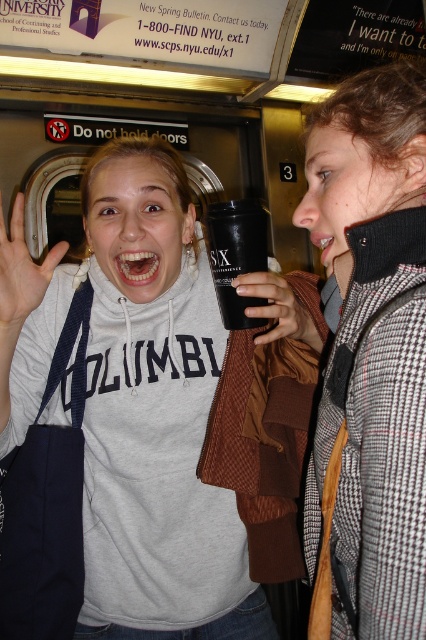
You are a photographer trying to capture a candid shot of the two people in the subway car. You want to ensure that both the gray sweatshirt at center and the light skin tone hand at center are in focus. Given that your camera has a depth of field that can sharply focus objects within a 10 inch range, will both subjects be in focus?

The gray sweatshirt at center is 11.63 inches away from the light skin tone hand at center. Since the distance between them exceeds the camera sensor depth of field range of 10 inches, both subjects cannot be in focus simultaneously.

Based on the scene description, which object is taller between the houndstooth wool coat at upper right and the light skin tone hand at center?

The houndstooth wool coat at upper right is much taller than the light skin tone hand at center.

You are a photographer trying to capture a closeup of the black matte cup at center without including the houndstooth wool coat at upper right in the frame. Based on their relative heights, can you position yourself lower to achieve this?

The houndstooth wool coat at upper right is much taller as black matte cup at center, so positioning yourself lower might help avoid including the coat in the frame since the cup is shorter and closer to the ground.